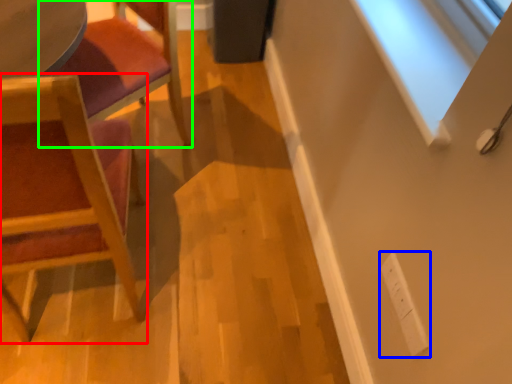
Question: Which is nearer to the chair (highlighted by a red box)? electric outlet (highlighted by a blue box) or chair (highlighted by a green box).

Choices:
 (A) electric outlet
 (B) chair

Answer: (B)